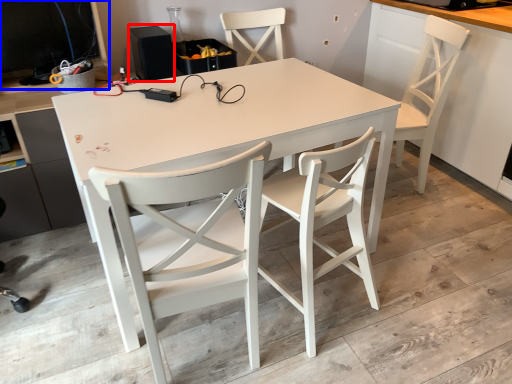
Question: Among these objects, which one is nearest to the camera, speaker (highlighted by a red box) or desktop computer (highlighted by a blue box)?

Choices:
 (A) speaker
 (B) desktop computer

Answer: (B)